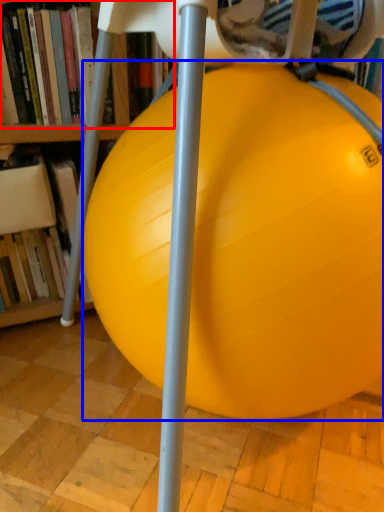
Question: Which object is closer to the camera taking this photo, book (highlighted by a red box) or ball (highlighted by a blue box)?

Choices:
 (A) book
 (B) ball

Answer: (B)